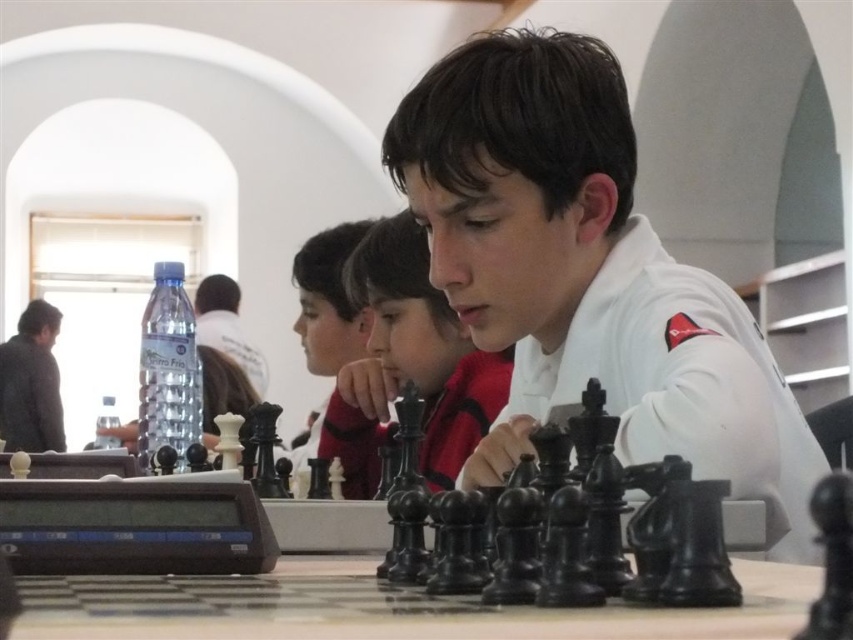
Question: Which of the following is the closest to the observer?

Choices:
 (A) (312, 440)
 (B) (509, 184)
 (C) (22, 364)
 (D) (260, 388)

Answer: (B)

Question: Is white matte shirt at center above dark gray sweater at left?

Choices:
 (A) yes
 (B) no

Answer: (A)

Question: Which point is farther to the camera?

Choices:
 (A) matte black chess piece at center
 (B) dark gray sweater at left
 (C) matte black chess set at center

Answer: (B)

Question: Considering the relative positions of matte black chess set at center and clear plastic bottle at center in the image provided, where is matte black chess set at center located with respect to clear plastic bottle at center?

Choices:
 (A) right
 (B) left

Answer: (A)

Question: Which is nearer to the clear plastic bottle at center?

Choices:
 (A) dark gray sweater at left
 (B) white matte shirt at center
 (C) matte black chess piece at center
 (D) matte black chess set at center

Answer: (A)

Question: In this image, where is matte black chess set at center located relative to matte black chess piece at center?

Choices:
 (A) right
 (B) left

Answer: (A)